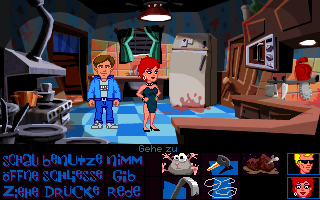
Where is `blue tiles`? This screenshot has width=320, height=200. blue tiles is located at coordinates (128, 128), (128, 117), (160, 128), (139, 137).